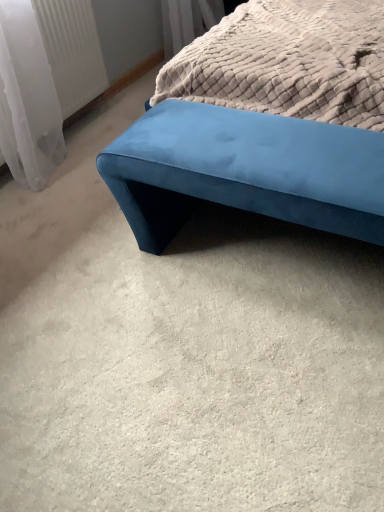
The width and height of the screenshot is (384, 512). In order to click on velvet blue bed at center in this screenshot , I will do `click(263, 124)`.

Describe the element at coordinates (263, 124) in the screenshot. I see `velvet blue bed at center` at that location.

Identify the location of velvet blue bed at center. (263, 124).